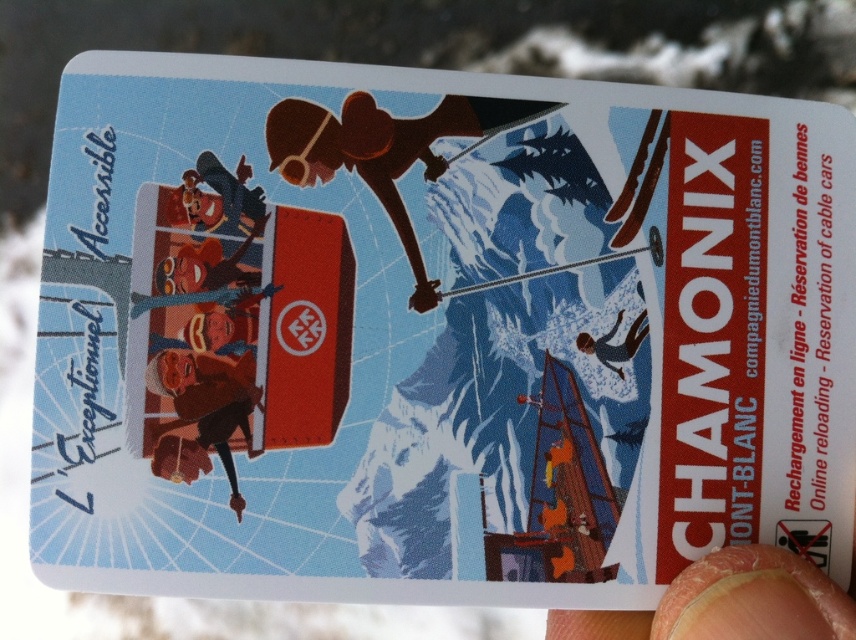
Question: Which point is farther from the camera taking this photo?

Choices:
 (A) (278, 106)
 (B) (634, 321)
 (C) (479, 211)

Answer: (B)

Question: Which is nearer to the matte brown jacket at center-left?

Choices:
 (A) matte brown skier at center
 (B) finger nail at lower right

Answer: (A)

Question: Is matte brown snowboarder at center further to camera compared to finger nail at lower right?

Choices:
 (A) yes
 (B) no

Answer: (A)

Question: Does matte brown snowboarder at center appear over blue matte skier at center?

Choices:
 (A) yes
 (B) no

Answer: (A)

Question: Which of the following is the closest to the observer?

Choices:
 (A) (288, 147)
 (B) (138, 307)
 (C) (801, 589)

Answer: (C)

Question: Does matte brown jacket at center-left have a larger size compared to matte brown snowboarder at center?

Choices:
 (A) no
 (B) yes

Answer: (A)